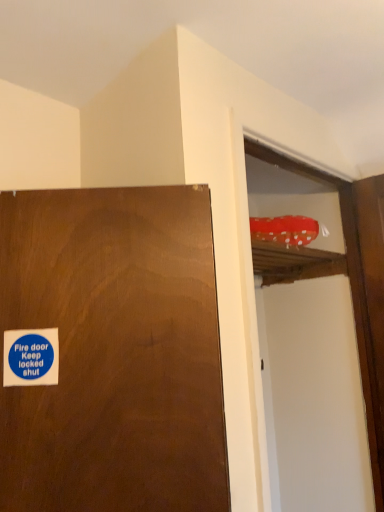
This screenshot has height=512, width=384. Find the location of `blue paper sticker at lower left`. blue paper sticker at lower left is located at coordinates (31, 357).

What do you see at coordinates (31, 357) in the screenshot? The height and width of the screenshot is (512, 384). I see `blue paper sticker at lower left` at bounding box center [31, 357].

What do you see at coordinates (352, 286) in the screenshot?
I see `red polka dot fabric at upper right` at bounding box center [352, 286].

Where is `red polka dot fabric at upper right`? This screenshot has height=512, width=384. red polka dot fabric at upper right is located at coordinates (352, 286).

Measure the distance between point (321, 263) and camera.

The depth of point (321, 263) is 5.50 feet.

Where is `blue paper sticker at lower left`? blue paper sticker at lower left is located at coordinates (31, 357).

Is red polka dot fabric at upper right at the right side of blue paper sticker at lower left?

Indeed, red polka dot fabric at upper right is positioned on the right side of blue paper sticker at lower left.

Is red polka dot fabric at upper right positioned behind blue paper sticker at lower left?

That is True.

Between point (364, 335) and point (19, 357), which one is positioned behind?

The point (364, 335) is more distant.

From the image's perspective, is red polka dot fabric at upper right located above blue paper sticker at lower left?

No, from the image's perspective, red polka dot fabric at upper right is not above blue paper sticker at lower left.

From a real-world perspective, which object rests below the other?

From a 3D spatial view, blue paper sticker at lower left is below.

Can you confirm if red polka dot fabric at upper right is thinner than blue paper sticker at lower left?

Incorrect, the width of red polka dot fabric at upper right is not less than that of blue paper sticker at lower left.

Considering the sizes of red polka dot fabric at upper right and blue paper sticker at lower left in the image, is red polka dot fabric at upper right taller or shorter than blue paper sticker at lower left?

Clearly, red polka dot fabric at upper right is taller compared to blue paper sticker at lower left.

Is red polka dot fabric at upper right bigger or smaller than blue paper sticker at lower left?

In the image, red polka dot fabric at upper right appears to be larger than blue paper sticker at lower left.

Is red polka dot fabric at upper right inside or outside of blue paper sticker at lower left?

red polka dot fabric at upper right is outside blue paper sticker at lower left.

Is red polka dot fabric at upper right next to blue paper sticker at lower left?

No, red polka dot fabric at upper right is not making contact with blue paper sticker at lower left.

Is red polka dot fabric at upper right facing towards blue paper sticker at lower left?

No, red polka dot fabric at upper right is not oriented towards blue paper sticker at lower left.

How different are the orientations of red polka dot fabric at upper right and blue paper sticker at lower left in degrees?

The angular difference between red polka dot fabric at upper right and blue paper sticker at lower left is 42.8 degrees.

Locate an element on the screen. sticker that appears below the red polka dot fabric at upper right (from a real-world perspective) is located at coordinates (31, 357).

Is blue paper sticker at lower left to the right of red polka dot fabric at upper right from the viewer's perspective?

Incorrect, blue paper sticker at lower left is not on the right side of red polka dot fabric at upper right.

Is blue paper sticker at lower left positioned before red polka dot fabric at upper right?

Yes, it is.

Which point is more forward, (6, 352) or (352, 298)?

The point (6, 352) is in front.

From the image's perspective, is blue paper sticker at lower left positioned above or below red polka dot fabric at upper right?

Clearly, from the image's perspective, blue paper sticker at lower left is above red polka dot fabric at upper right.

From a real-world perspective, relative to red polka dot fabric at upper right, is blue paper sticker at lower left vertically above or below?

blue paper sticker at lower left is below red polka dot fabric at upper right.

Is blue paper sticker at lower left thinner than red polka dot fabric at upper right?

Indeed, blue paper sticker at lower left has a lesser width compared to red polka dot fabric at upper right.

Considering the relative sizes of blue paper sticker at lower left and red polka dot fabric at upper right in the image provided, is blue paper sticker at lower left taller than red polka dot fabric at upper right?

No, blue paper sticker at lower left is not taller than red polka dot fabric at upper right.

Considering the relative sizes of blue paper sticker at lower left and red polka dot fabric at upper right in the image provided, is blue paper sticker at lower left bigger than red polka dot fabric at upper right?

Actually, blue paper sticker at lower left might be smaller than red polka dot fabric at upper right.

From the picture: Do you think blue paper sticker at lower left is within red polka dot fabric at upper right, or outside of it?

blue paper sticker at lower left is outside red polka dot fabric at upper right.

Are blue paper sticker at lower left and red polka dot fabric at upper right making contact?

There is a gap between blue paper sticker at lower left and red polka dot fabric at upper right.

Is blue paper sticker at lower left positioned with its back to red polka dot fabric at upper right?

No, blue paper sticker at lower left is not facing the opposite direction of red polka dot fabric at upper right.

How many degrees apart are the facing directions of blue paper sticker at lower left and red polka dot fabric at upper right?

42.8 degrees separate the facing orientations of blue paper sticker at lower left and red polka dot fabric at upper right.

Find the location of a particular element. The width and height of the screenshot is (384, 512). screen door that appears behind the blue paper sticker at lower left is located at coordinates tap(352, 286).

Where is `sticker in front of the red polka dot fabric at upper right`? sticker in front of the red polka dot fabric at upper right is located at coordinates coord(31,357).

Locate an element on the screen. The height and width of the screenshot is (512, 384). screen door behind the blue paper sticker at lower left is located at coordinates (352, 286).